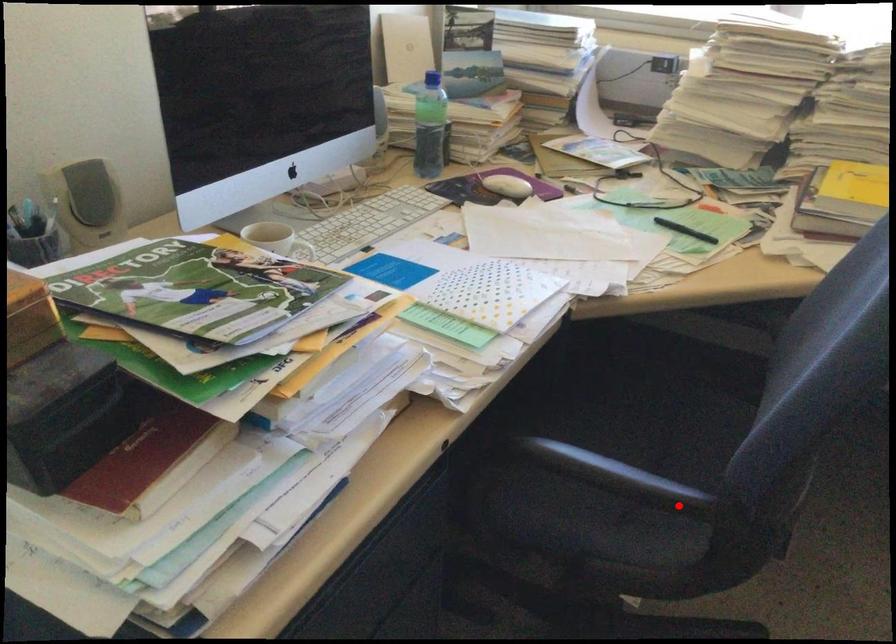
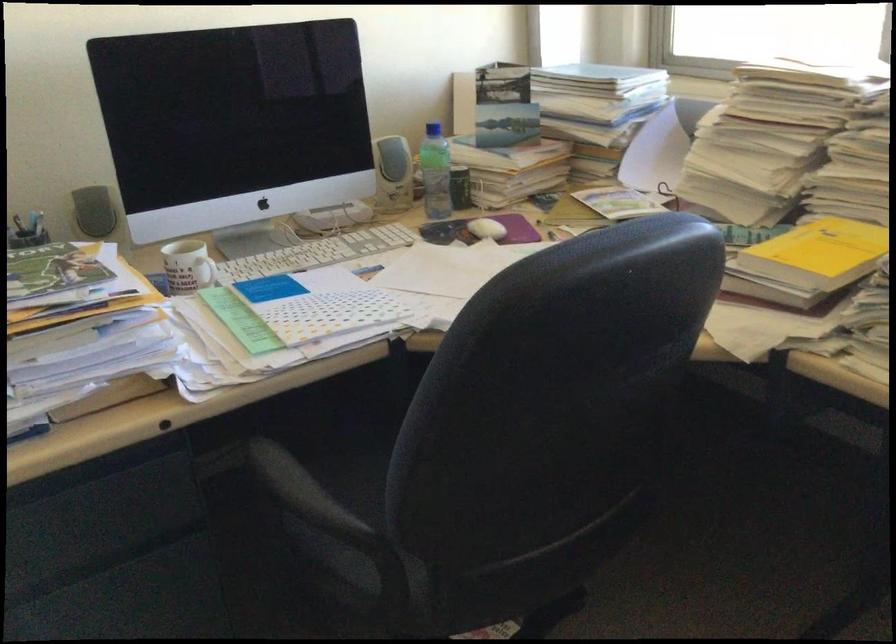
Question: I am providing you with two images of the same scene from different viewpoints. A red point is marked on the first image. Is the red point's position out of view in image 2?

Choices:
 (A) Yes
 (B) No

Answer: (B)